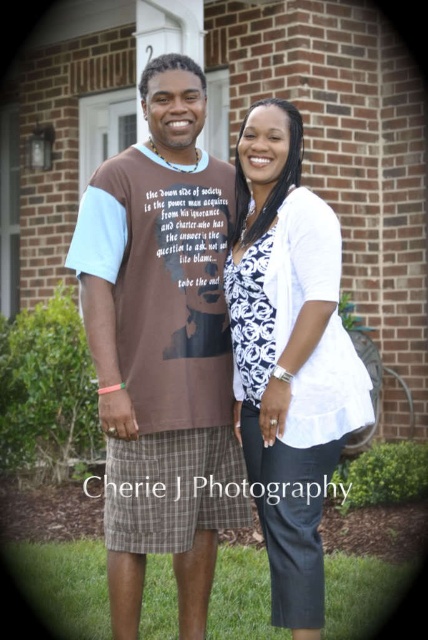
Between brown cotton t-shirt at center and white textured blouse at center, which one is positioned higher?

brown cotton t-shirt at center is higher up.

Who is taller, brown cotton t-shirt at center or white textured blouse at center?

With more height is brown cotton t-shirt at center.

Locate an element on the screen. This screenshot has width=428, height=640. brown cotton t-shirt at center is located at coordinates (162, 346).